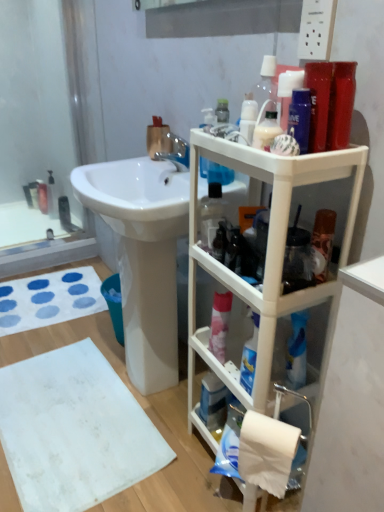
Where is `blank space situated above white matte bath towel at lower left, which appears as the second bath towel when viewed from the back (from a real-world perspective)`? The height and width of the screenshot is (512, 384). blank space situated above white matte bath towel at lower left, which appears as the second bath towel when viewed from the back (from a real-world perspective) is located at coordinates (66, 417).